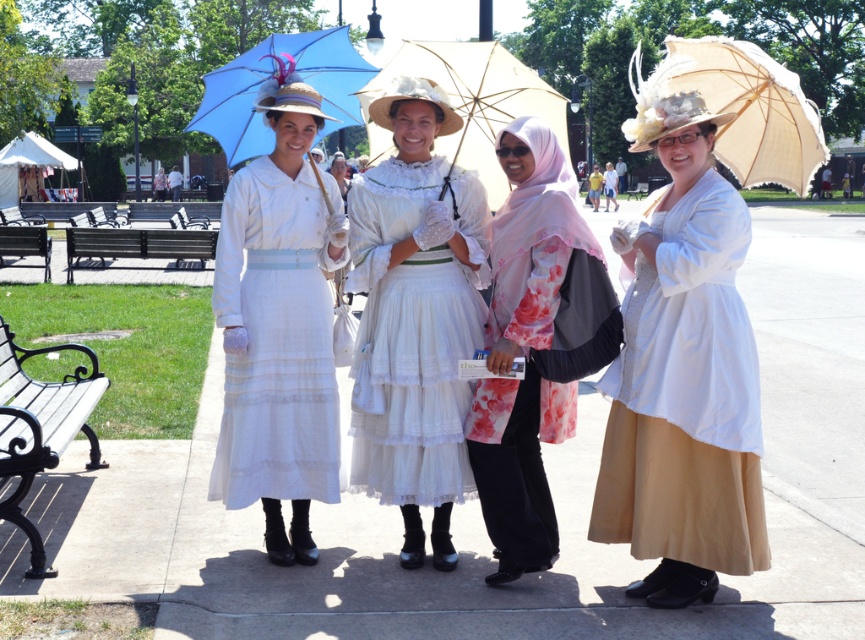
In the scene shown: Who is taller, matte white dress at center or beige lace parasol at upper right?

Standing taller between the two is beige lace parasol at upper right.

Can you confirm if matte white dress at center is bigger than beige lace parasol at upper right?

Incorrect, matte white dress at center is not larger than beige lace parasol at upper right.

What do you see at coordinates (279, 324) in the screenshot?
I see `matte white dress at center` at bounding box center [279, 324].

Identify the location of matte white dress at center. The image size is (865, 640). (279, 324).

Measure the distance between smooth concrete sidewalk at center and pink floral fabric hijab at center.

smooth concrete sidewalk at center and pink floral fabric hijab at center are 1.97 meters apart.

Does smooth concrete sidewalk at center have a larger size compared to pink floral fabric hijab at center?

Correct, smooth concrete sidewalk at center is larger in size than pink floral fabric hijab at center.

Who is more forward, (782, 506) or (527, 280)?

Point (527, 280) is in front.

Where is `smooth concrete sidewalk at center`? This screenshot has height=640, width=865. smooth concrete sidewalk at center is located at coordinates (479, 509).

Which is more to the right, beige lace parasol at upper right or black wooden bench at left?

Positioned to the right is beige lace parasol at upper right.

The width and height of the screenshot is (865, 640). I want to click on beige lace parasol at upper right, so click(734, 108).

Between point (753, 177) and point (180, 253), which one is positioned behind?

The point (180, 253) is more distant.

You are a GUI agent. You are given a task and a screenshot of the screen. Output one action in this format:
    pyautogui.click(x=<x>, y=<y>)
    Task: Click on the beige lace parasol at upper right
    The image size is (865, 640).
    Given the screenshot: What is the action you would take?
    pyautogui.click(x=734, y=108)